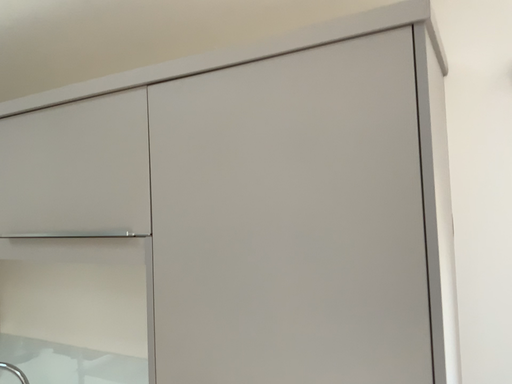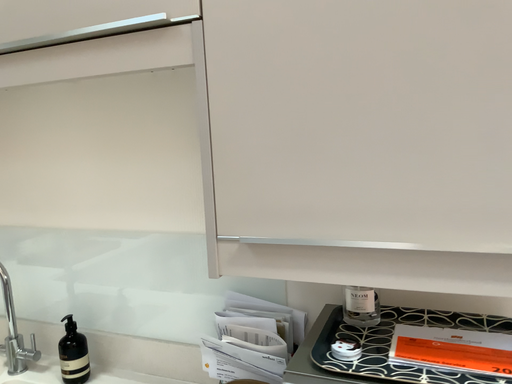
Question: How did the camera likely rotate when shooting the video?

Choices:
 (A) rotated left
 (B) rotated right

Answer: (B)